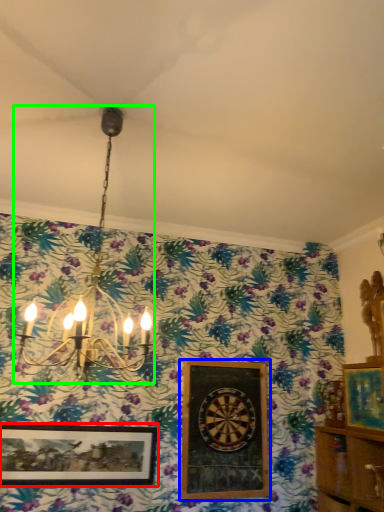
Question: Based on their relative distances, which object is nearer to picture frame (highlighted by a red box)? Choose from picture frame (highlighted by a blue box) and lamp (highlighted by a green box).

Choices:
 (A) picture frame
 (B) lamp

Answer: (A)